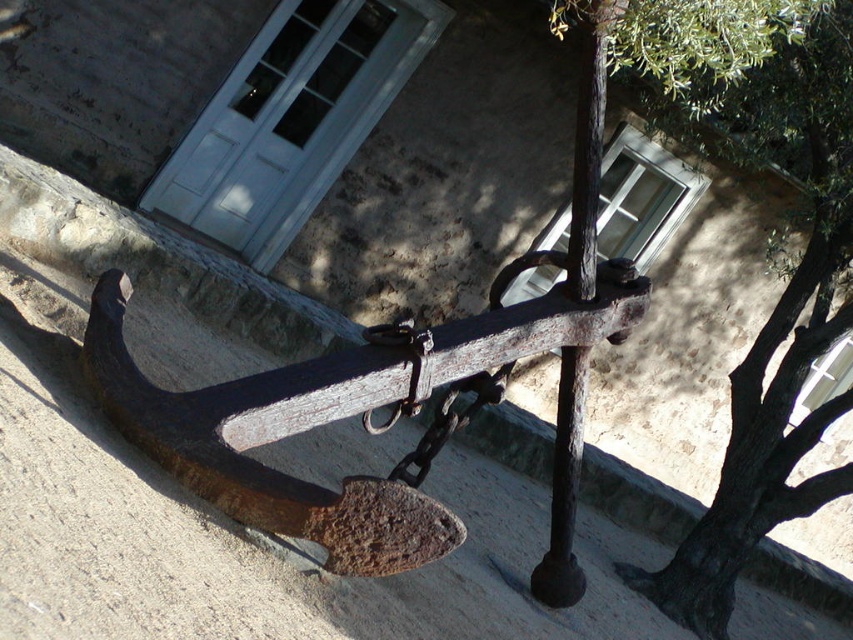
Question: Where is rusty metal anchor at center located in relation to green leafy tree at upper right in the image?

Choices:
 (A) left
 (B) right

Answer: (A)

Question: Is rusty metal anchor at center bigger than green leafy tree at upper right?

Choices:
 (A) yes
 (B) no

Answer: (A)

Question: Which point is farther to the camera?

Choices:
 (A) (747, 524)
 (B) (281, 404)

Answer: (A)

Question: Is the position of rusty metal anchor at center less distant than that of green leafy tree at upper right?

Choices:
 (A) yes
 (B) no

Answer: (A)